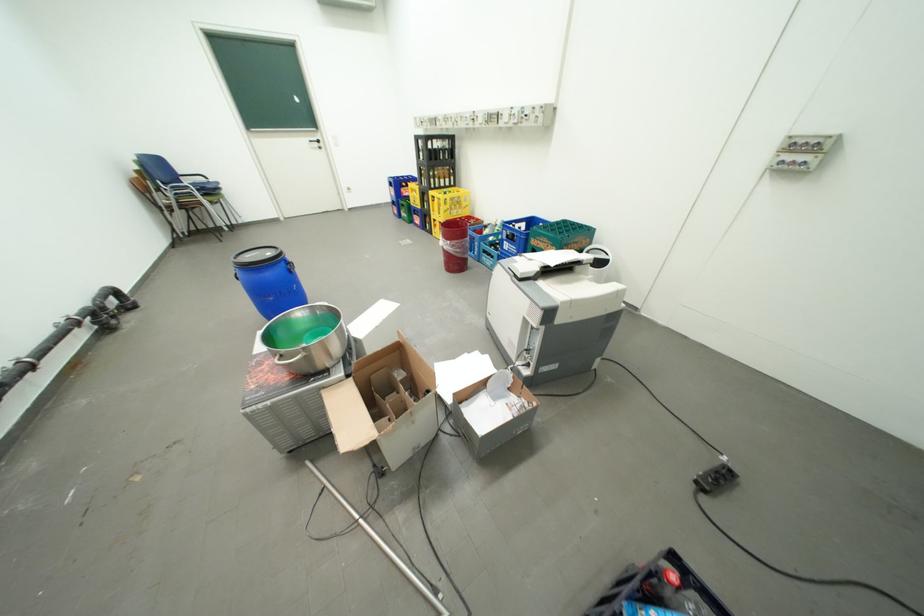
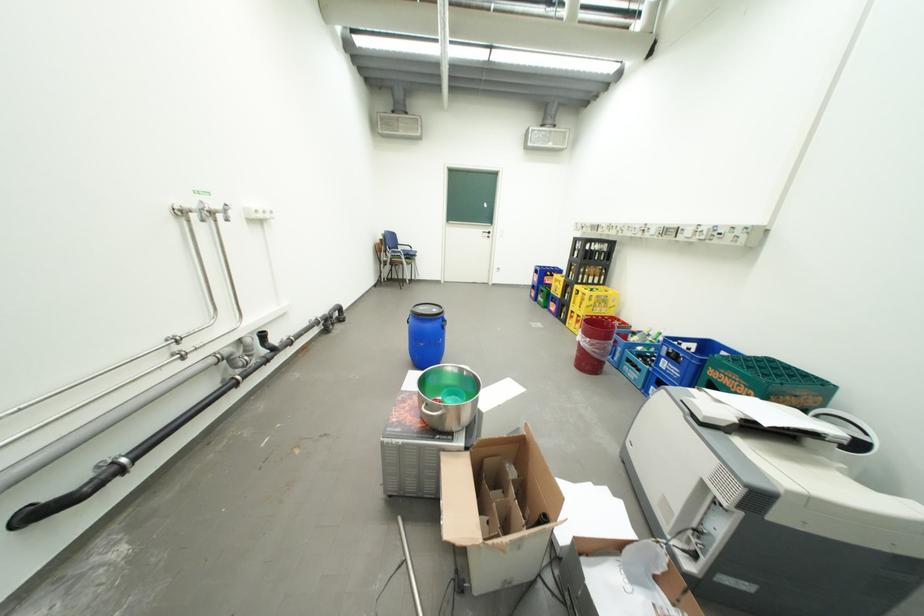
In the second image, find the point that corresponds to (x=251, y=257) in the first image.

(428, 309)